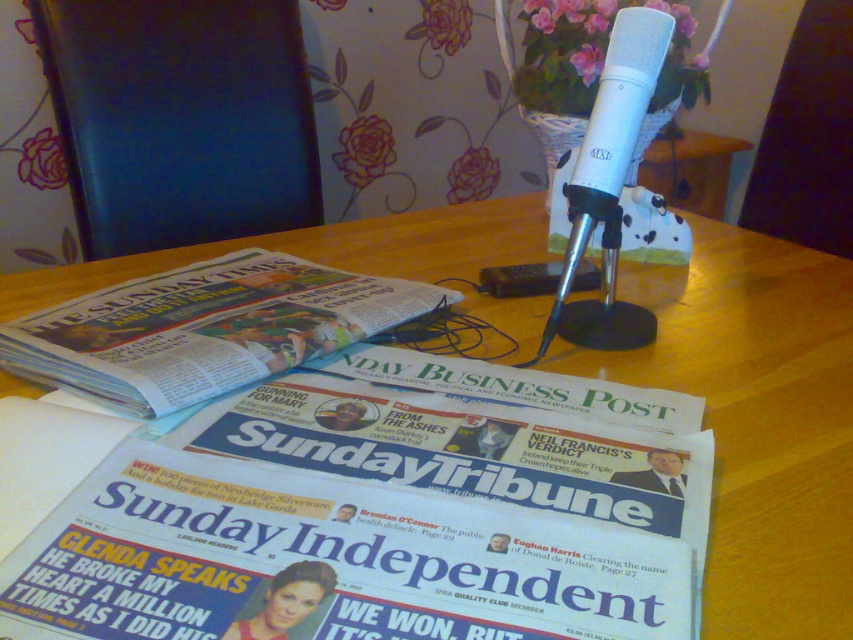
You are a journalist who needs to place a new document on the table. The document requires a surface that is both flat and large enough. Considering the white glossy newspaper at center and the white matte microphone at center, which object can provide a suitable surface for placing the document?

The white glossy newspaper at center can provide a suitable surface for placing the document because it is shorter than the white matte microphone at center, meaning it has a larger flat area available.

You are a photographer trying to capture a closeup of the white glossy newspaper at center without the microphone getting in the way. The wooden table at center is in the background. What is the minimum distance you need to move forward to ensure the microphone is out of frame?

The wooden table at center is 5.95 inches away from the white glossy newspaper at center. To ensure the microphone is out of frame, you need to move forward at least 5.95 inches closer to the white glossy newspaper at center so that the wooden table at center is no longer in the background.

You are organizing a press conference and need to place a laptop between the wooden table at center and the white matte microphone at center. Can you fit the laptop between them?

The wooden table at center is larger in size than the white matte microphone at center, so there is sufficient space between them to place a laptop.